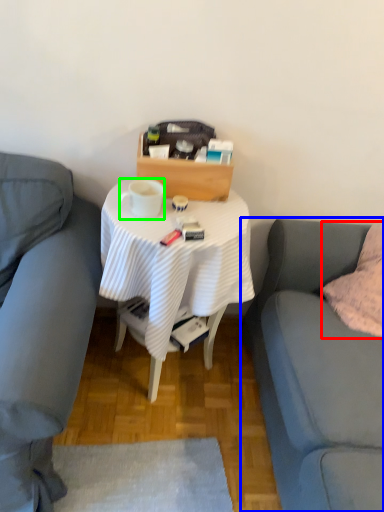
Question: Which is nearer to the pillow (highlighted by a red box)? studio couch (highlighted by a blue box) or coffee cup (highlighted by a green box).

Choices:
 (A) studio couch
 (B) coffee cup

Answer: (A)